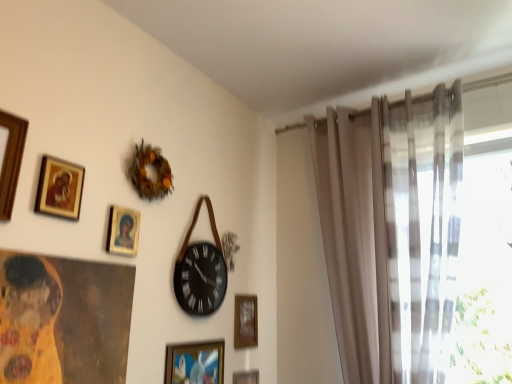
In order to click on black leather wall clock at center in this screenshot , I will do `click(200, 279)`.

The width and height of the screenshot is (512, 384). I want to click on metallic gold picture frame at lower center, acting as the 2th picture frame starting from the back, so pyautogui.click(x=246, y=377).

What do you see at coordinates (392, 232) in the screenshot? The image size is (512, 384). I see `sheer beige curtain at right` at bounding box center [392, 232].

What is the approximate height of wooden picture frame at upper left, which ranks as the sixth picture frame in right-to-left order?

wooden picture frame at upper left, which ranks as the sixth picture frame in right-to-left order, is 12.95 inches tall.

This screenshot has width=512, height=384. Describe the element at coordinates (11, 161) in the screenshot. I see `wooden picture frame at upper left, the first picture frame positioned from the top` at that location.

Locate an element on the screen. The image size is (512, 384). matte gold picture frame at upper center, the fourth picture frame positioned from the right is located at coordinates (123, 231).

Identify the location of gold-framed picture at lower center, the fifth picture frame when ordered from top to bottom. (195, 363).

Is gold-framed picture at lower center, which is the 2th picture frame in bottom-to-top order, to the right of matte gold picture frame at upper center, the fourth picture frame positioned from the right, from the viewer's perspective?

Yes.

Is gold-framed picture at lower center, the 4th picture frame in the front-to-back sequence, bigger or smaller than matte gold picture frame at upper center, which is the fourth picture frame from back to front?

In the image, gold-framed picture at lower center, the 4th picture frame in the front-to-back sequence, appears to be larger than matte gold picture frame at upper center, which is the fourth picture frame from back to front.

Considering the sizes of gold-framed picture at lower center, the third picture frame in the right-to-left sequence, and matte gold picture frame at upper center, which is the fourth picture frame from back to front, in the image, is gold-framed picture at lower center, the third picture frame in the right-to-left sequence, wider or thinner than matte gold picture frame at upper center, which is the fourth picture frame from back to front,?

Considering their sizes, gold-framed picture at lower center, the third picture frame in the right-to-left sequence, looks broader than matte gold picture frame at upper center, which is the fourth picture frame from back to front.

Considering the points (191, 376) and (135, 228), which point is behind, point (191, 376) or point (135, 228)?

Positioned behind is point (191, 376).

Would you say wooden picture frame at upper left, acting as the 1th picture frame starting from the left, is a long distance from metallic gold picture frame at lower center, marked as the 5th picture frame in a front-to-back arrangement?

Indeed, wooden picture frame at upper left, acting as the 1th picture frame starting from the left, is not near metallic gold picture frame at lower center, marked as the 5th picture frame in a front-to-back arrangement.

From a real-world perspective, is wooden picture frame at upper left, acting as the 1th picture frame starting from the left, above or below metallic gold picture frame at lower center, the sixth picture frame positioned from the top?

In terms of real-world spatial position, wooden picture frame at upper left, acting as the 1th picture frame starting from the left, is above metallic gold picture frame at lower center, the sixth picture frame positioned from the top.

Is point (6, 117) less distant than point (247, 380)?

Yes, point (6, 117) is in front of point (247, 380).

How many degrees apart are the facing directions of wooden picture frame at upper left, acting as the 1th picture frame starting from the left, and metallic gold picture frame at lower center, acting as the 2th picture frame starting from the back?

They differ by 0.00366 degrees in their facing directions.

Considering the sizes of objects matte gold picture frame at upper center, positioned as the fourth picture frame in bottom-to-top order, and sheer beige curtain at right in the image provided, who is wider, matte gold picture frame at upper center, positioned as the fourth picture frame in bottom-to-top order, or sheer beige curtain at right?

sheer beige curtain at right is wider.

From a real-world perspective, relative to sheer beige curtain at right, is matte gold picture frame at upper center, which is the fourth picture frame from back to front, vertically above or below?

matte gold picture frame at upper center, which is the fourth picture frame from back to front, is situated lower than sheer beige curtain at right in the real world.

Considering the positions of point (118, 241) and point (370, 332), is point (118, 241) closer or farther from the camera than point (370, 332)?

Point (118, 241).

Which of these two, black leather wall clock at center or gold-framed picture at lower center, which appears as the 4th picture frame when viewed from the left, is bigger?

Bigger between the two is black leather wall clock at center.

From a real-world perspective, does black leather wall clock at center stand above gold-framed picture at lower center, which is the 2th picture frame in bottom-to-top order?

Indeed, from a real-world perspective, black leather wall clock at center stands above gold-framed picture at lower center, which is the 2th picture frame in bottom-to-top order.

Could you measure the distance between black leather wall clock at center and gold-framed picture at lower center, which is the 2th picture frame in bottom-to-top order?

black leather wall clock at center and gold-framed picture at lower center, which is the 2th picture frame in bottom-to-top order, are 10.02 inches apart from each other.

Is black leather wall clock at center in contact with gold-framed picture at lower center, positioned as the third picture frame in back-to-front order?

black leather wall clock at center is not next to gold-framed picture at lower center, positioned as the third picture frame in back-to-front order, and they're not touching.

Where is `the 3rd picture frame to the right when counting from the gold-framed picture at upper left, the fifth picture frame viewed from the back`? the 3rd picture frame to the right when counting from the gold-framed picture at upper left, the fifth picture frame viewed from the back is located at coordinates (246, 377).

Which of these two, metallic gold picture frame at lower center, which ranks as the second picture frame in right-to-left order, or gold-framed picture at upper left, which is the 2th picture frame from front to back, stands shorter?

Standing shorter between the two is metallic gold picture frame at lower center, which ranks as the second picture frame in right-to-left order.

Is gold-framed picture at upper left, positioned as the 2th picture frame in top-to-bottom order, located within metallic gold picture frame at lower center, which ranks as the second picture frame in right-to-left order?

No, gold-framed picture at upper left, positioned as the 2th picture frame in top-to-bottom order, is located outside of metallic gold picture frame at lower center, which ranks as the second picture frame in right-to-left order.

Considering the sizes of matte gold picture frame at upper center, the fourth picture frame positioned from the right, and wooden picture frame at center, placed as the 1th picture frame when sorted from back to front, in the image, is matte gold picture frame at upper center, the fourth picture frame positioned from the right, wider or thinner than wooden picture frame at center, placed as the 1th picture frame when sorted from back to front,?

Considering their sizes, matte gold picture frame at upper center, the fourth picture frame positioned from the right, looks slimmer than wooden picture frame at center, placed as the 1th picture frame when sorted from back to front.

From the picture: Which object is positioned more to the right, matte gold picture frame at upper center, which is the fourth picture frame from back to front, or wooden picture frame at center, placed as the 1th picture frame when sorted from back to front?

wooden picture frame at center, placed as the 1th picture frame when sorted from back to front.

Considering the sizes of matte gold picture frame at upper center, the fourth picture frame positioned from the right, and wooden picture frame at center, placed as the 1th picture frame when sorted from back to front, in the image, is matte gold picture frame at upper center, the fourth picture frame positioned from the right, bigger or smaller than wooden picture frame at center, placed as the 1th picture frame when sorted from back to front,?

In the image, matte gold picture frame at upper center, the fourth picture frame positioned from the right, appears to be smaller than wooden picture frame at center, placed as the 1th picture frame when sorted from back to front.

How different are the orientations of matte gold picture frame at upper center, acting as the 3th picture frame starting from the top, and wooden picture frame at center, the fourth picture frame when ordered from top to bottom, in degrees?

0.00754 degrees separate the facing orientations of matte gold picture frame at upper center, acting as the 3th picture frame starting from the top, and wooden picture frame at center, the fourth picture frame when ordered from top to bottom.

Is gold-framed picture at lower center, the third picture frame in the right-to-left sequence, not near black leather wall clock at center?

Actually, gold-framed picture at lower center, the third picture frame in the right-to-left sequence, and black leather wall clock at center are a little close together.

Can you confirm if gold-framed picture at lower center, the fifth picture frame when ordered from top to bottom, is smaller than black leather wall clock at center?

Yes.

At what (x,y) coordinates should I click in order to perform the action: click on wall clock above the gold-framed picture at lower center, the third picture frame in the right-to-left sequence (from the image's perspective). Please return your answer as a coordinate pair (x, y). The height and width of the screenshot is (384, 512). Looking at the image, I should click on (200, 279).

How much distance is there between gold-framed picture at lower center, which is the 2th picture frame in bottom-to-top order, and black leather wall clock at center?

gold-framed picture at lower center, which is the 2th picture frame in bottom-to-top order, is 10.02 inches away from black leather wall clock at center.

From the image's perspective, count 2nd picture frames upward from the gold-framed picture at lower center, positioned as the third picture frame in back-to-front order, and point to it. Please provide its 2D coordinates.

[(123, 231)]

Identify the location of picture frame that is the 4th one when counting rightward from the wooden picture frame at upper left, acting as the 1th picture frame starting from the left. (246, 377).

Looking at the image, which one is located further to wooden picture frame at center, placed as the 1th picture frame when sorted from back to front, gold-framed picture at upper left, the 5th picture frame when ordered from right to left, or black leather wall clock at center?

gold-framed picture at upper left, the 5th picture frame when ordered from right to left.

Based on their spatial positions, is gold-framed picture at upper left, which is the 2th picture frame from front to back, or gold-framed picture at lower center, the 4th picture frame in the front-to-back sequence, closer to wooden picture frame at center, which is counted as the sixth picture frame, starting from the front?

The object closer to wooden picture frame at center, which is counted as the sixth picture frame, starting from the front, is gold-framed picture at lower center, the 4th picture frame in the front-to-back sequence.

Which object lies further to the anchor point matte gold picture frame at upper center, positioned as the fourth picture frame in bottom-to-top order, wooden picture frame at upper left, which ranks as the 6th picture frame in bottom-to-top order, or black leather wall clock at center?

black leather wall clock at center lies further to matte gold picture frame at upper center, positioned as the fourth picture frame in bottom-to-top order, than the other object.

Which object lies nearer to the anchor point matte gold picture frame at upper center, which is the fourth picture frame from back to front, metallic gold picture frame at lower center, acting as the 2th picture frame starting from the back, or black leather wall clock at center?

black leather wall clock at center.

Estimate the real-world distances between objects in this image. Which object is closer to wooden picture frame at upper left, which ranks as the sixth picture frame in right-to-left order, matte gold picture frame at upper center, which is the fourth picture frame from back to front, or wooden picture frame at center, marked as the third picture frame in a bottom-to-top arrangement?

matte gold picture frame at upper center, which is the fourth picture frame from back to front, lies closer to wooden picture frame at upper left, which ranks as the sixth picture frame in right-to-left order, than the other object.

Which object lies nearer to the anchor point gold-framed picture at lower center, which appears as the 4th picture frame when viewed from the left, black leather wall clock at center or wooden picture frame at center, marked as the first picture frame in a right-to-left arrangement?

black leather wall clock at center is positioned closer to the anchor gold-framed picture at lower center, which appears as the 4th picture frame when viewed from the left.

From the picture: When comparing their distances from matte gold picture frame at upper center, acting as the 3th picture frame starting from the top, does black leather wall clock at center or gold-framed picture at lower center, which appears as the 4th picture frame when viewed from the left, seem further?

Based on the image, gold-framed picture at lower center, which appears as the 4th picture frame when viewed from the left, appears to be further to matte gold picture frame at upper center, acting as the 3th picture frame starting from the top.

Considering their positions, is sheer beige curtain at right positioned further to gold-framed picture at lower center, the 4th picture frame in the front-to-back sequence, than metallic gold picture frame at lower center, which ranks as the second picture frame in right-to-left order?

Based on the image, sheer beige curtain at right appears to be further to gold-framed picture at lower center, the 4th picture frame in the front-to-back sequence.

In order to click on wall clock between wooden picture frame at upper left, acting as the 1th picture frame starting from the left, and metallic gold picture frame at lower center, which ranks as the second picture frame in right-to-left order, in the front-back direction in this screenshot , I will do `click(200, 279)`.

You are a GUI agent. You are given a task and a screenshot of the screen. Output one action in this format:
    pyautogui.click(x=<x>, y=<y>)
    Task: Click on the wall clock that lies between matte gold picture frame at upper center, which is the fourth picture frame from back to front, and gold-framed picture at lower center, which appears as the 4th picture frame when viewed from the left, from top to bottom
    The height and width of the screenshot is (384, 512).
    Given the screenshot: What is the action you would take?
    pyautogui.click(x=200, y=279)

At what (x,y) coordinates should I click in order to perform the action: click on wall clock that lies between matte gold picture frame at upper center, acting as the 3th picture frame starting from the top, and metallic gold picture frame at lower center, positioned as the 1th picture frame in bottom-to-top order, from top to bottom. Please return your answer as a coordinate pair (x, y). Image resolution: width=512 pixels, height=384 pixels. Looking at the image, I should click on (200, 279).

The height and width of the screenshot is (384, 512). Identify the location of wall clock between matte gold picture frame at upper center, acting as the 3th picture frame starting from the top, and wooden picture frame at center, the sixth picture frame viewed from the left, from front to back. (200, 279).